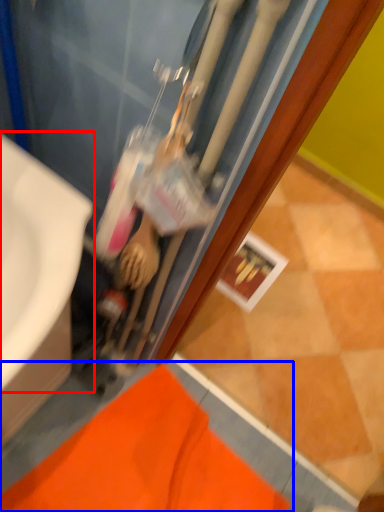
Question: Among these objects, which one is nearest to the camera, sink (highlighted by a red box) or bath mat (highlighted by a blue box)?

Choices:
 (A) sink
 (B) bath mat

Answer: (A)